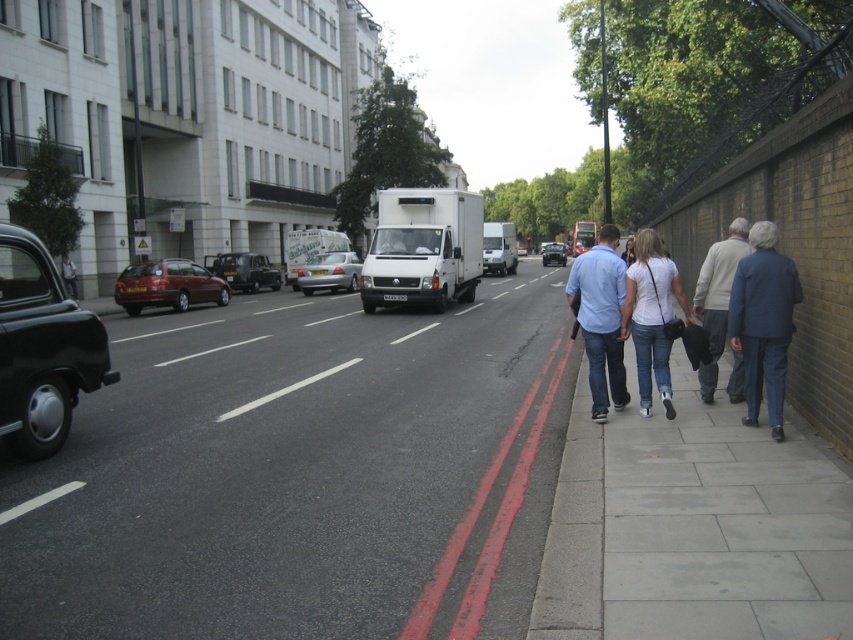
You are a fashion designer observing a street scene with a white cotton shirt at center and a light gray sweater at right. Which clothing item appears larger in size?

The light gray sweater at right is larger than the white cotton shirt at center.